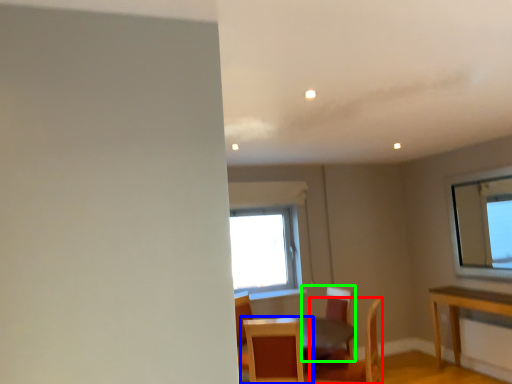
Question: Which is farther away from chair (highlighted by a red box)? chair (highlighted by a blue box) or chair (highlighted by a green box)?

Choices:
 (A) chair
 (B) chair

Answer: (A)